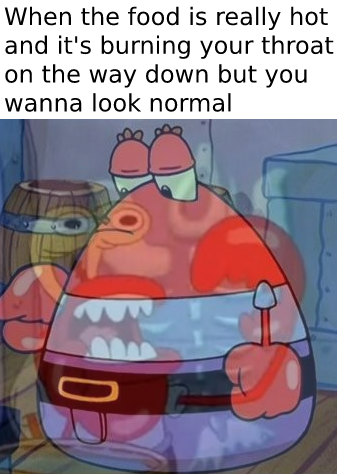
Locate an element on the screen. The image size is (337, 474). brown  wooden barrel in image on left is located at coordinates (19, 195).